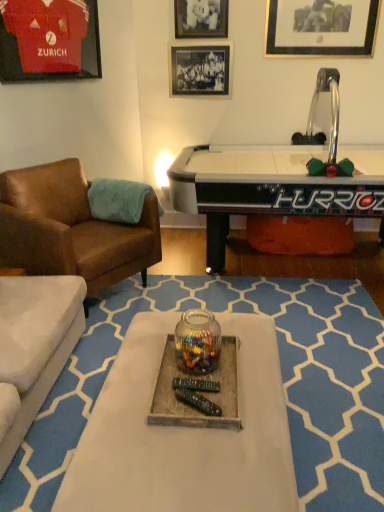
The width and height of the screenshot is (384, 512). What are the coordinates of `free space to the back side of black plastic remote control at center, arranged as the second remote control when viewed from the back` in the screenshot? It's located at (195, 378).